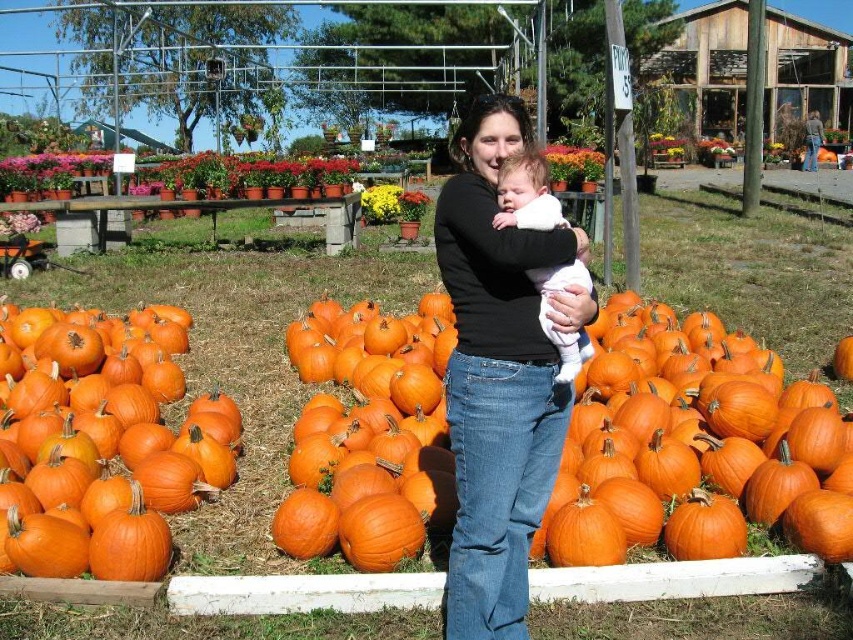
You are standing at the edge of the pumpkin patch and want to hand the orange matte pumpkin at left to the person wearing the black matte shirt at center. Can you reach them without moving from your current position?

The orange matte pumpkin at left is 2.69 meters away from the black matte shirt at center. Since the average human arm length is about 0.7 meters, you cannot reach them without moving closer.

You are a photographer trying to capture a photo of the black matte shirt at center and the white soft baby at center. Which object should you focus on first if you want to ensure both are in focus?

The black matte shirt at center is much taller than the white soft baby at center, so focusing on the black matte shirt at center first would help ensure both are in focus since it is farther away.